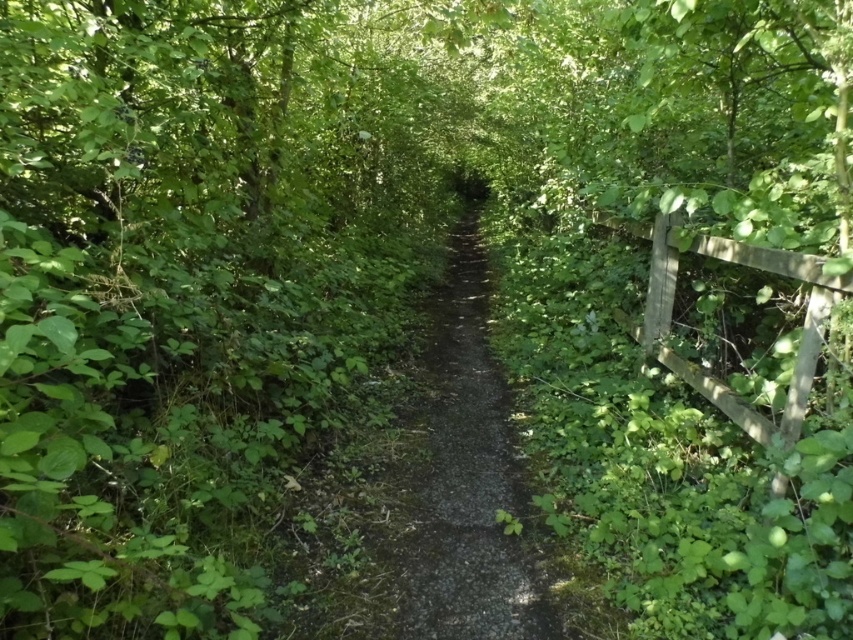
Question: Is dirt/gravel path at center in front of wooden fence at right?

Choices:
 (A) yes
 (B) no

Answer: (B)

Question: Which of the following is the farthest from the observer?

Choices:
 (A) (480, 627)
 (B) (761, 424)

Answer: (B)

Question: Does dirt/gravel path at center have a smaller size compared to wooden fence at right?

Choices:
 (A) yes
 (B) no

Answer: (B)

Question: Which point appears closest to the camera in this image?

Choices:
 (A) (469, 328)
 (B) (672, 248)

Answer: (B)

Question: Can you confirm if dirt/gravel path at center is positioned below wooden fence at right?

Choices:
 (A) no
 (B) yes

Answer: (B)